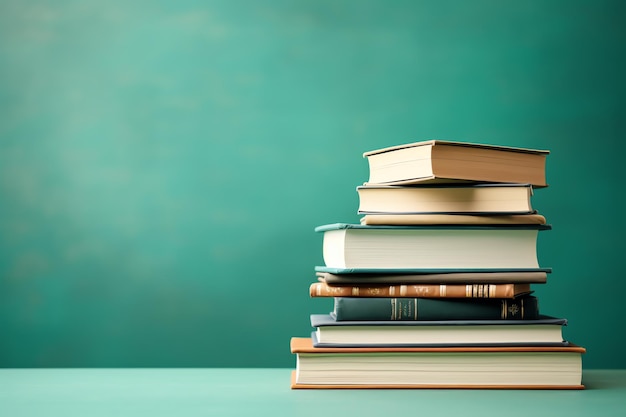
In order to click on books in this screenshot , I will do `click(394, 361)`, `click(393, 326)`, `click(386, 314)`, `click(473, 288)`, `click(466, 251)`, `click(446, 218)`, `click(434, 206)`, `click(454, 170)`.